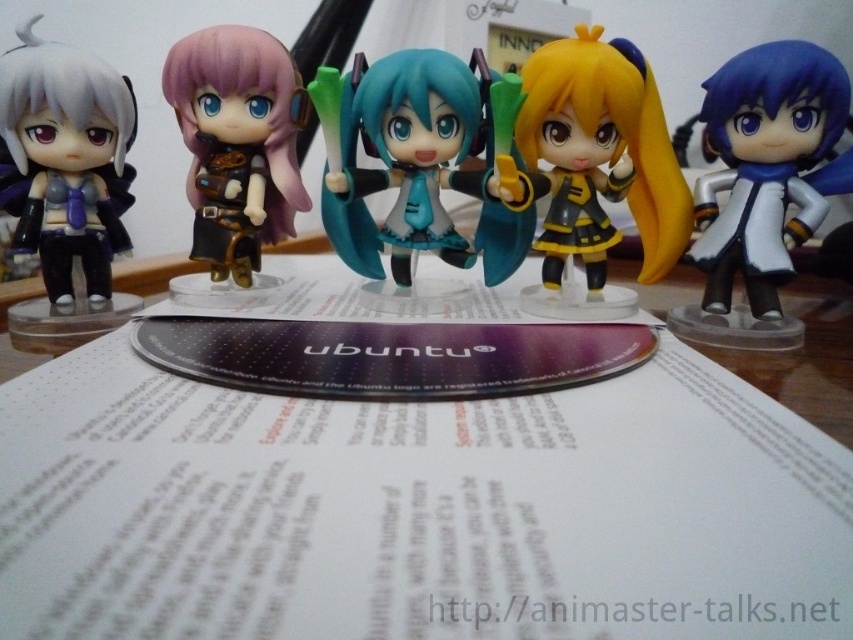
Based on the photo, you are organizing the figurines on the wooden surface and need to place a new figurine exactly where the yellow matte figure at center is currently positioned. According to the coordinates provided, where should you place the new figurine?

The yellow matte figure at center is located at point (x=595, y=170), so you should place the new figurine at those coordinates.

You are organizing a display of the figures and need to place a small label next to each. The label for the white glossy figure at right must be taller than the label for the matte gold armor at center. Given their heights, is this requirement possible to fulfill?

The white glossy figure at right is much taller than the matte gold armor at center, so yes, the label for the white glossy figure at right can be made taller than the label for the matte gold armor at center to meet the requirement.

You are organizing a display of the five figurines and need to place a label next to the matte black figure at left. The label must be exactly 18 inches away from the figure. Can you place the label on the white paper at center?

The white paper at center is 17.61 inches away from the matte black figure at left. Since 17.61 inches is less than 18 inches, placing the label on the white paper at center would not meet the requirement of being exactly 18 inches away from the figure.